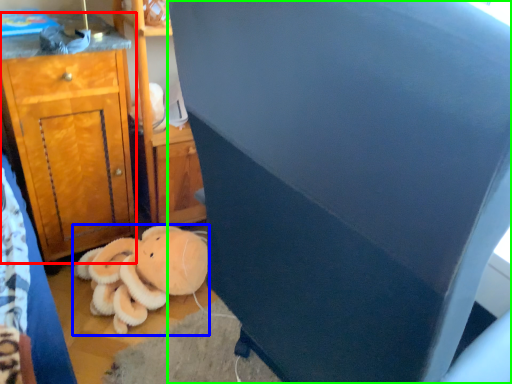
Question: Considering the real-world distances, which object is farthest from cabinetry (highlighted by a red box)? teddy bear (highlighted by a blue box) or furniture (highlighted by a green box)?

Choices:
 (A) teddy bear
 (B) furniture

Answer: (B)